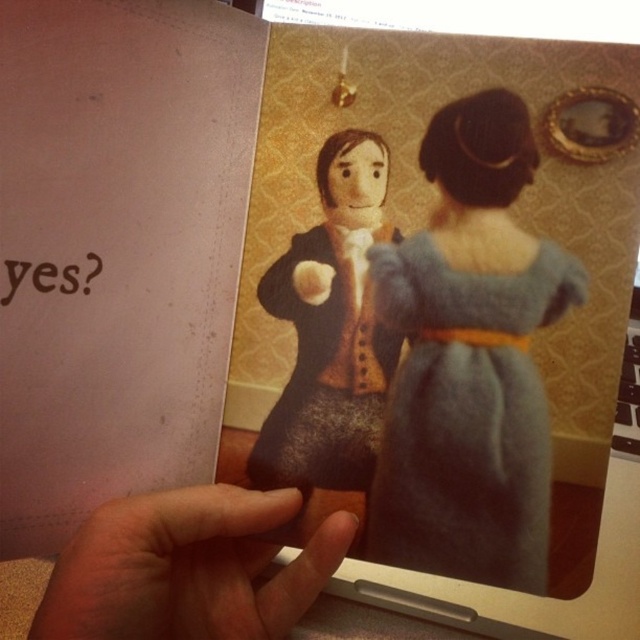
Between blue felt dress at center and fuzzy skin at lower left, which one is positioned higher?

blue felt dress at center is higher up.

Between blue felt dress at center and fuzzy skin at lower left, which one is positioned lower?

fuzzy skin at lower left is lower down.

Is point (449, 218) farther from camera compared to point (77, 614)?

Yes.

The image size is (640, 640). In order to click on blue felt dress at center in this screenshot , I will do [468, 360].